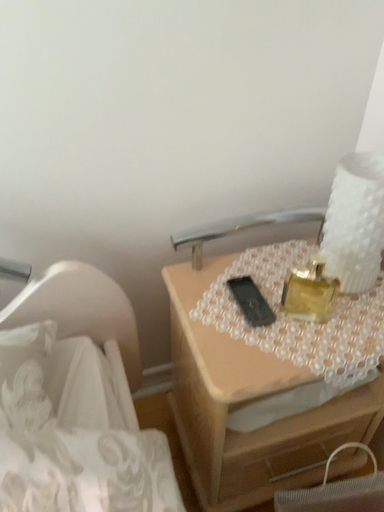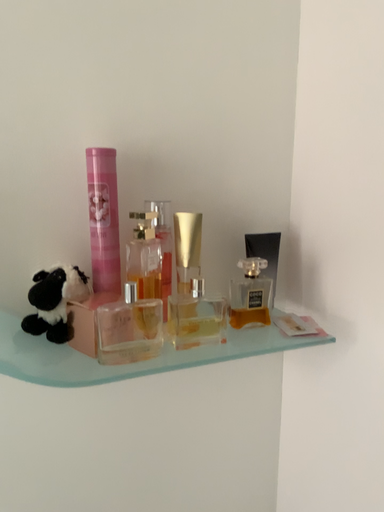
Question: How did the camera likely rotate when shooting the video?

Choices:
 (A) rotated upward
 (B) rotated downward

Answer: (A)